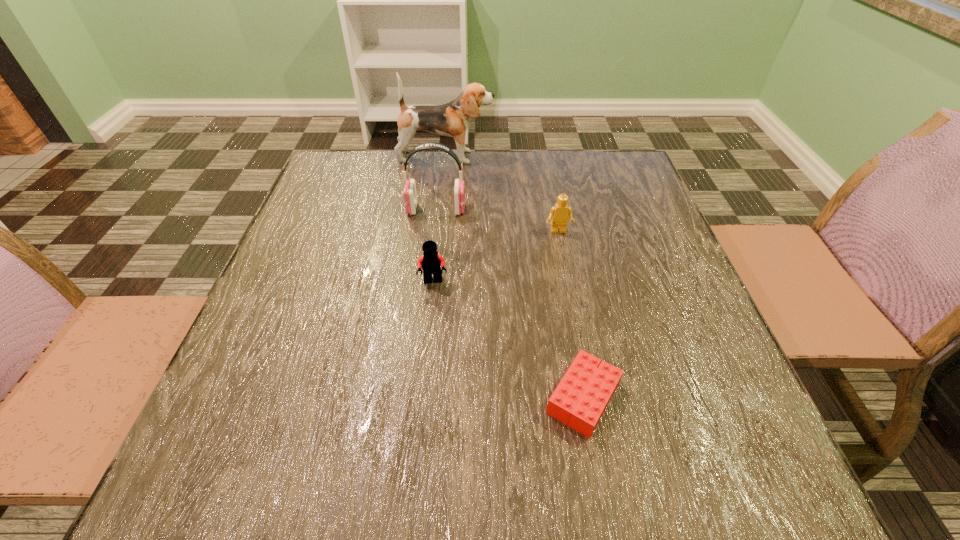
This screenshot has width=960, height=540. I want to click on free area in between the third farthest object and the earphone, so click(497, 220).

The image size is (960, 540). What are the coordinates of `object that stands as the fourth closest to the nearest Lego` in the screenshot? It's located at coord(452,119).

Locate an element on the screen. This screenshot has width=960, height=540. object that stands as the fourth closest to the second farthest Lego is located at coordinates (452, 119).

The image size is (960, 540). I want to click on Lego that is the second closest to the puppy, so click(x=431, y=262).

Select which Lego is the second closest to the puppy. Please provide its 2D coordinates. Your answer should be formatted as a tuple, i.e. [(x, y)], where the tuple contains the x and y coordinates of a point satisfying the conditions above.

[(431, 262)]

Locate an element on the screen. Image resolution: width=960 pixels, height=540 pixels. free space that satisfies the following two spatial constraints: 1. on the back side of the shortest Lego; 2. on the outer surface of the earphone is located at coordinates (549, 210).

At what (x,y) coordinates should I click in order to perform the action: click on blank space that satisfies the following two spatial constraints: 1. on the front-facing side of the second farthest Lego; 2. on the right side of the shortest Lego. Please return your answer as a coordinate pair (x, y). This screenshot has height=540, width=960. Looking at the image, I should click on (421, 398).